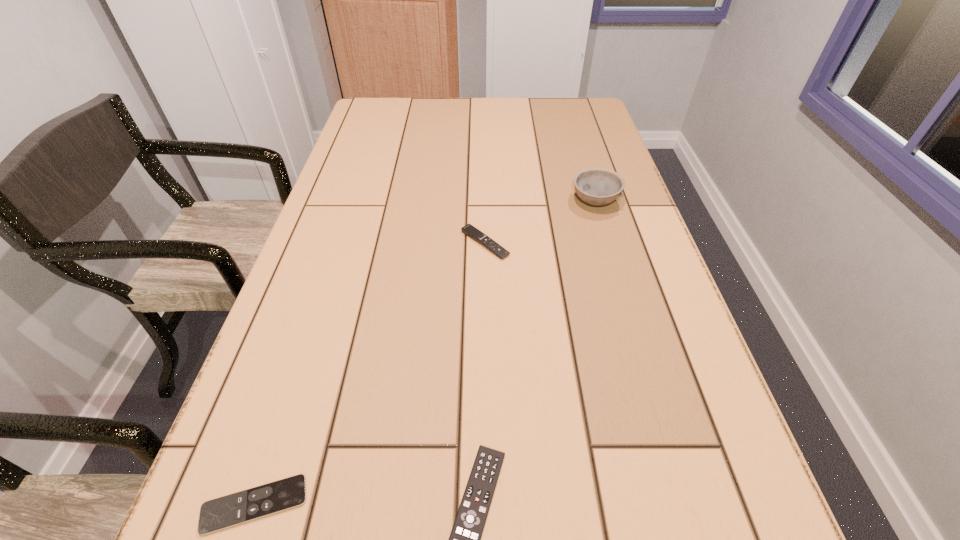
Where is `bowl`? This screenshot has width=960, height=540. bowl is located at coordinates (596, 186).

I want to click on the tallest object, so click(596, 186).

Where is `the tallest remote control`? This screenshot has height=540, width=960. the tallest remote control is located at coordinates (469, 230).

Identify the location of the farthest remote control. (469, 230).

Identify the location of the leftmost object. The height and width of the screenshot is (540, 960). (251, 504).

The height and width of the screenshot is (540, 960). Find the location of `the shortest remote control`. the shortest remote control is located at coordinates (251, 504).

Locate an element on the screen. The image size is (960, 540). free space located 0.170m on the front of the rightmost object is located at coordinates (614, 267).

This screenshot has height=540, width=960. What are the coordinates of `vacant point located 0.150m on the left of the third shortest object` in the screenshot? It's located at (394, 244).

This screenshot has width=960, height=540. I want to click on vacant region located on the back of the leftmost object, so 287,406.

Find the location of a particular element. object that is at the left edge is located at coordinates (251, 504).